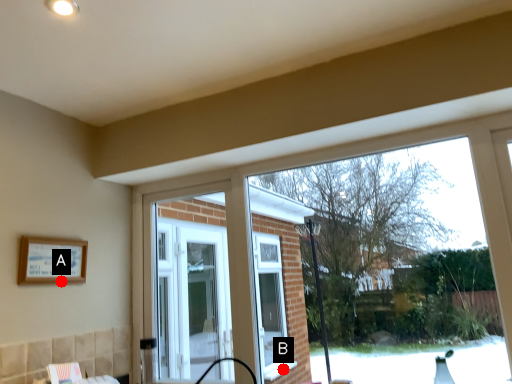
Question: Two points are circled on the image, labeled by A and B beside each circle. Which point appears farthest from the camera in this image?

Choices:
 (A) A is further
 (B) B is further

Answer: (B)